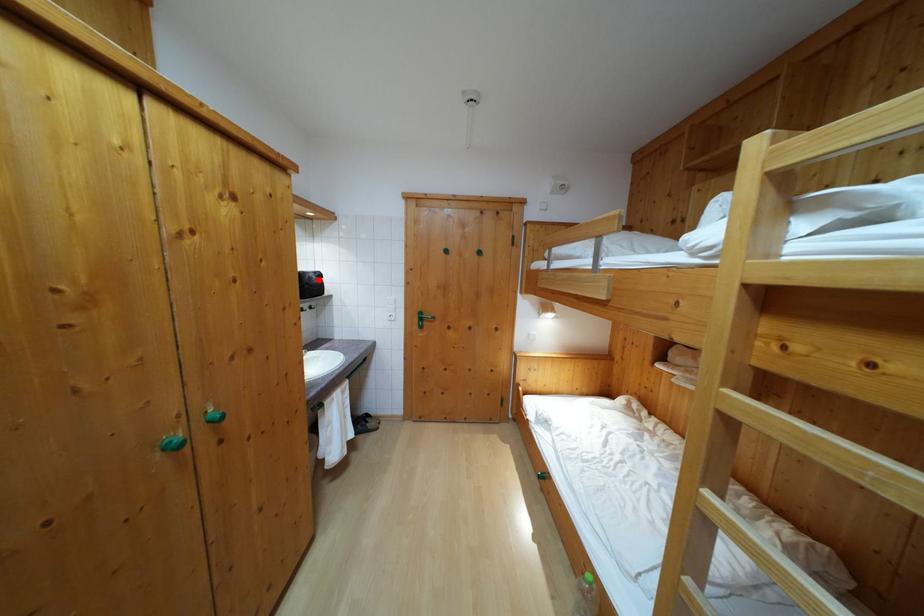
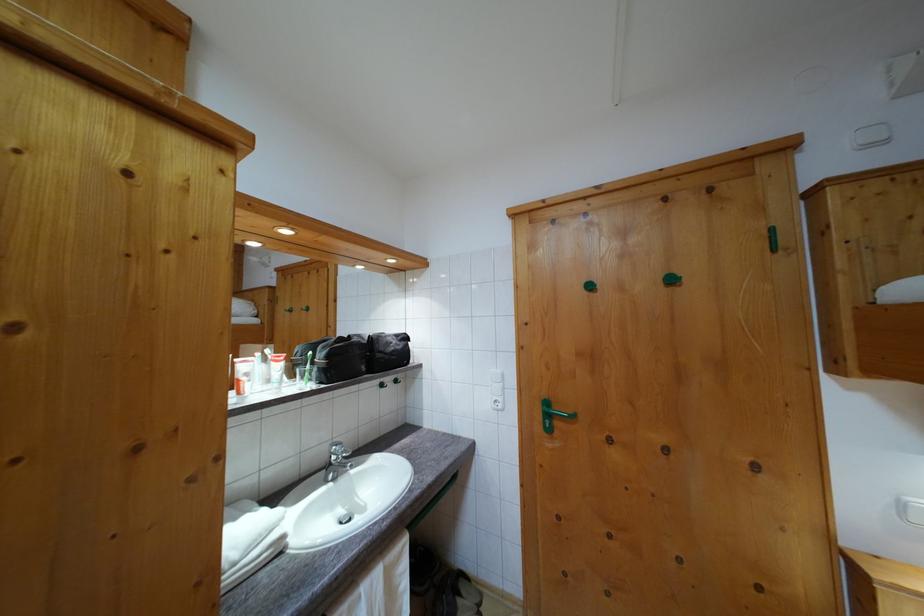
The point at the highlighted location is marked in the first image. Where is the corresponding point in the second image?

(400, 342)